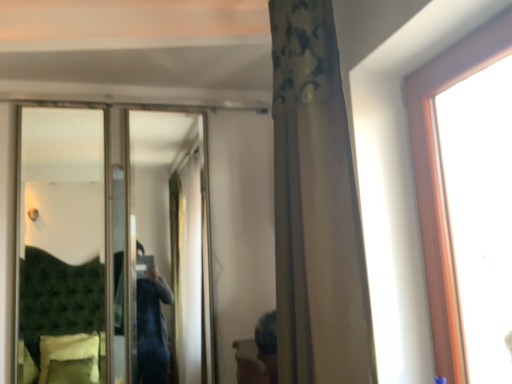
Question: From a real-world perspective, is metallic silver mirror at center above or below white textured curtain at center?

Choices:
 (A) below
 (B) above

Answer: (A)

Question: In terms of width, does metallic silver mirror at center look wider or thinner when compared to white textured curtain at center?

Choices:
 (A) thin
 (B) wide

Answer: (A)

Question: Considering the positions of point (34, 210) and point (322, 296), is point (34, 210) closer or farther from the camera than point (322, 296)?

Choices:
 (A) farther
 (B) closer

Answer: (A)

Question: Considering the positions of point coord(333,314) and point coord(81,296), is point coord(333,314) closer or farther from the camera than point coord(81,296)?

Choices:
 (A) closer
 (B) farther

Answer: (A)

Question: From the image's perspective, is white textured curtain at center located above or below metallic silver mirror at center?

Choices:
 (A) above
 (B) below

Answer: (A)

Question: In terms of width, does white textured curtain at center look wider or thinner when compared to metallic silver mirror at center?

Choices:
 (A) thin
 (B) wide

Answer: (B)

Question: Based on their sizes in the image, would you say white textured curtain at center is bigger or smaller than metallic silver mirror at center?

Choices:
 (A) big
 (B) small

Answer: (A)